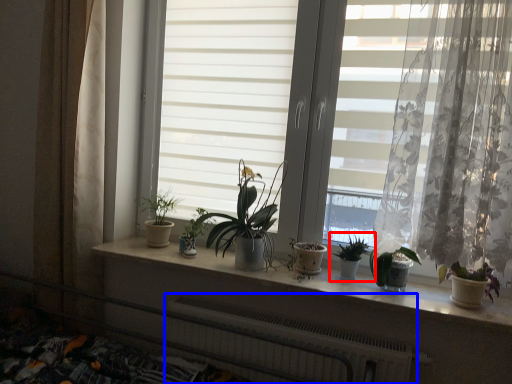
Question: Among these objects, which one is nearest to the camera, houseplant (highlighted by a red box) or radiator (highlighted by a blue box)?

Choices:
 (A) houseplant
 (B) radiator

Answer: (B)